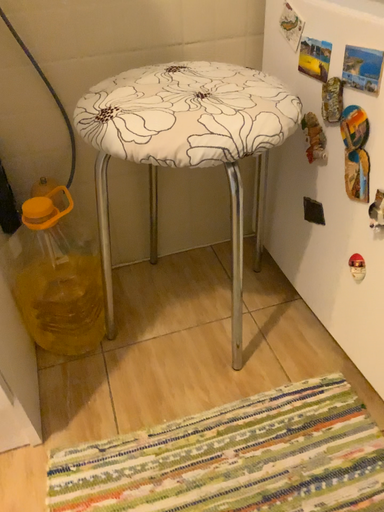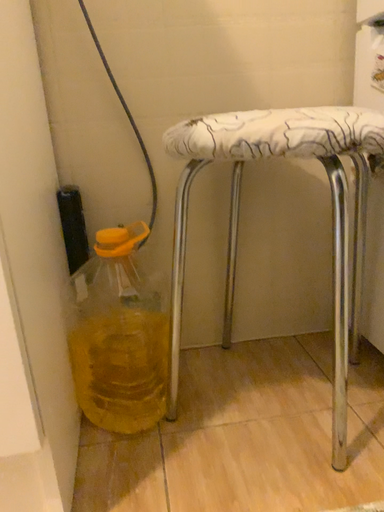
Question: Which way did the camera rotate in the video?

Choices:
 (A) rotated downward
 (B) rotated upward

Answer: (B)